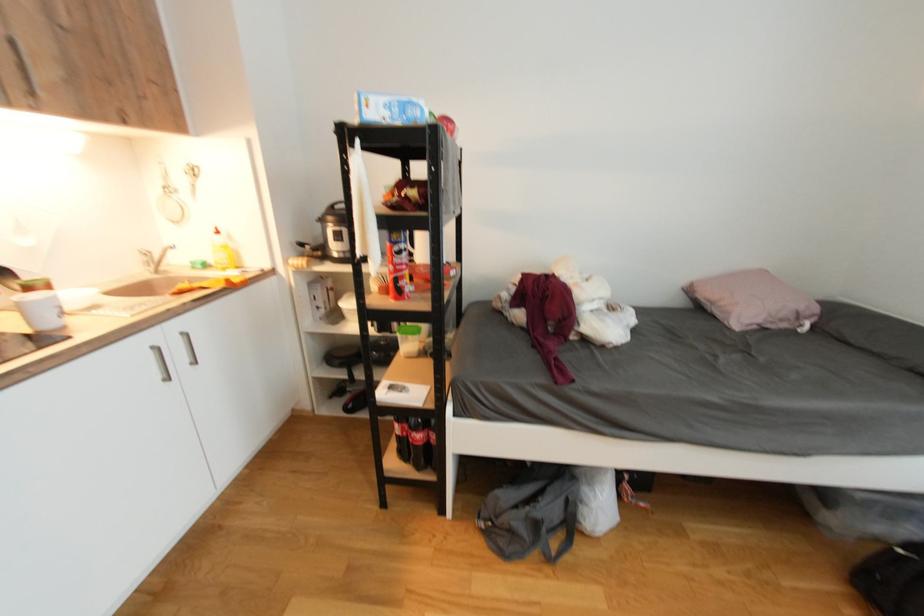
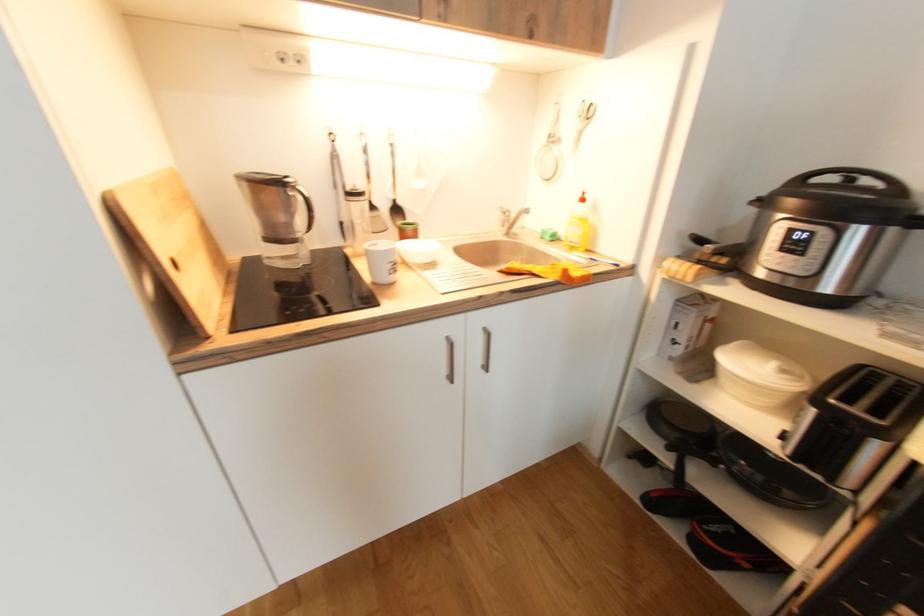
Question: How did the camera likely rotate?

Choices:
 (A) Left
 (B) Right
 (C) Up
 (D) Down

Answer: (A)